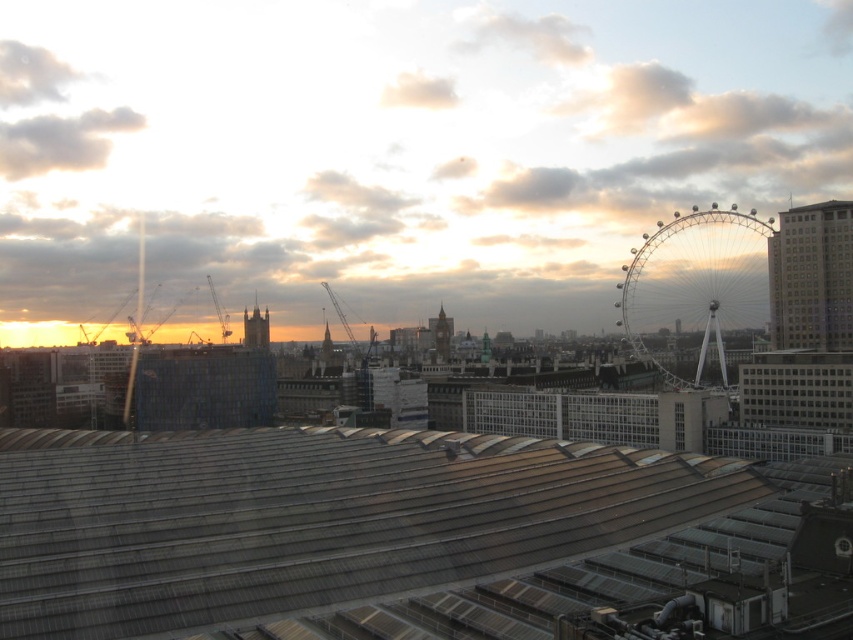
Is metallic gray roof at center further to the viewer compared to silver metallic ferris wheel at upper right?

That is False.

Is point (703, 496) farther from viewer compared to point (659, 314)?

No, it is not.

Identify the location of metallic gray roof at center. pyautogui.click(x=363, y=525).